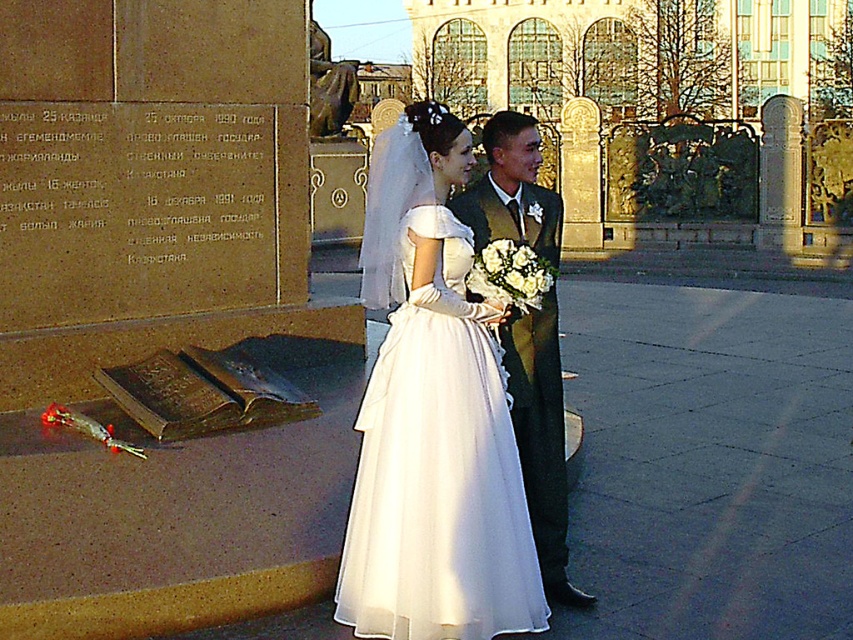
Question: Can you confirm if white tulle dress at center is positioned below shiny dark green suit at center?

Choices:
 (A) no
 (B) yes

Answer: (B)

Question: Where is white tulle dress at center located in relation to shiny dark green suit at center in the image?

Choices:
 (A) right
 (B) left

Answer: (B)

Question: Does white tulle dress at center appear over shiny dark green suit at center?

Choices:
 (A) no
 (B) yes

Answer: (A)